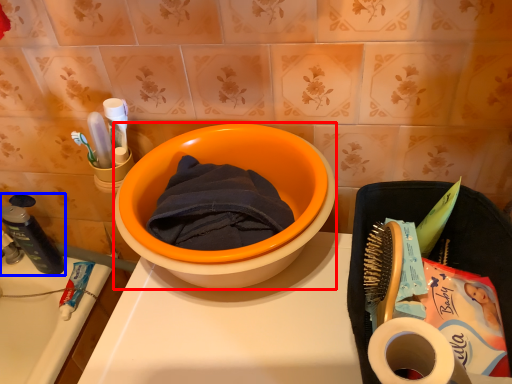
Question: Which object appears farthest to the camera in this image, basin (highlighted by a red box) or stationery (highlighted by a blue box)?

Choices:
 (A) basin
 (B) stationery

Answer: (B)